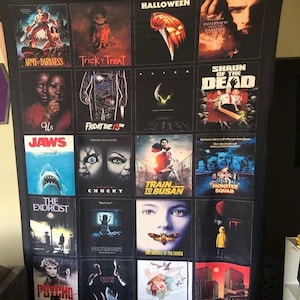
This screenshot has width=300, height=300. Find the location of `wall`. wall is located at coordinates (290, 40), (2, 190).